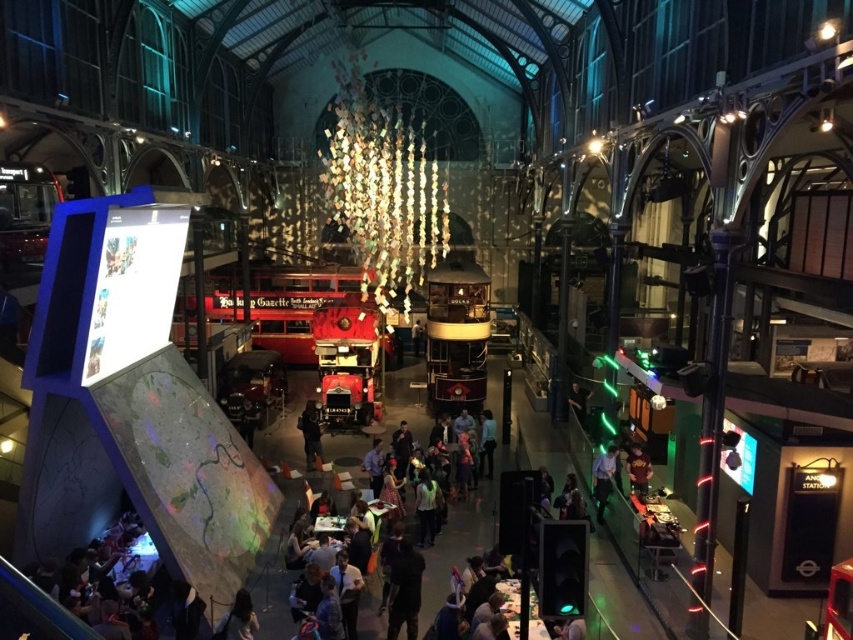
From the picture: Who is more distant from viewer, (434, 483) or (607, 458)?

Point (607, 458)

What do you see at coordinates (426, 508) in the screenshot?
I see `light blue fabric shirt at center` at bounding box center [426, 508].

You are a GUI agent. You are given a task and a screenshot of the screen. Output one action in this format:
    pyautogui.click(x=<x>, y=<y>)
    Task: Click on the light blue fabric shirt at center
    
    Given the screenshot: What is the action you would take?
    pyautogui.click(x=426, y=508)

Image resolution: width=853 pixels, height=640 pixels. I want to click on light blue fabric shirt at center, so click(x=426, y=508).

What do you see at coordinates (310, 433) in the screenshot?
I see `black matte jacket at center` at bounding box center [310, 433].

Can you confirm if black matte jacket at center is positioned above dark blue jeans at center?

Yes.

Between point (320, 445) and point (494, 445), which one is positioned in front?

Point (494, 445)

This screenshot has width=853, height=640. Find the location of `black matte jacket at center`. black matte jacket at center is located at coordinates 310,433.

Is light blue fabric shirt at center to the left of dark brown leather jacket at lower right from the viewer's perspective?

Correct, you'll find light blue fabric shirt at center to the left of dark brown leather jacket at lower right.

Does light blue fabric shirt at center have a greater width compared to dark brown leather jacket at lower right?

Indeed, light blue fabric shirt at center has a greater width compared to dark brown leather jacket at lower right.

Which is in front, point (432, 499) or point (627, 458)?

Point (432, 499)

Find the location of a particular element. This screenshot has height=640, width=853. light blue fabric shirt at center is located at coordinates (426, 508).